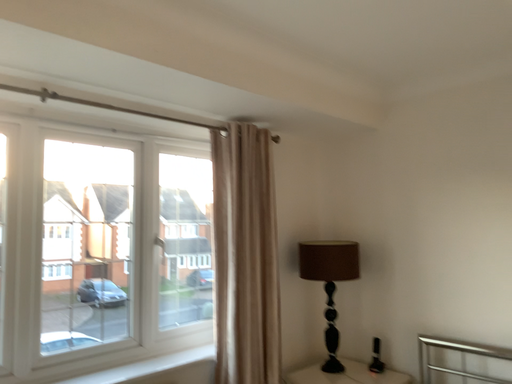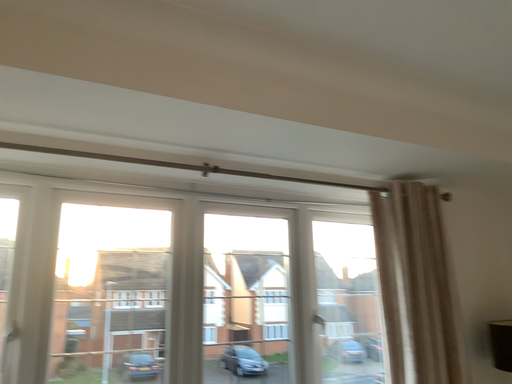
Question: How did the camera likely rotate when shooting the video?

Choices:
 (A) rotated left
 (B) rotated right

Answer: (A)